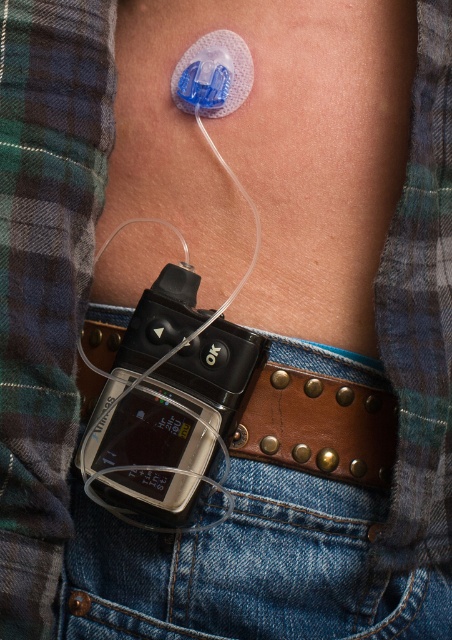
Question: Is denim at lower center smaller than brown leather belt at lower center?

Choices:
 (A) yes
 (B) no

Answer: (A)

Question: Is denim at lower center below brown leather belt at lower center?

Choices:
 (A) yes
 (B) no

Answer: (A)

Question: Which object is farther from the camera taking this photo?

Choices:
 (A) brown leather belt at lower center
 (B) denim at lower center

Answer: (B)

Question: Does denim at lower center have a smaller size compared to brown leather belt at lower center?

Choices:
 (A) yes
 (B) no

Answer: (A)

Question: Which of the following is the closest to the observer?

Choices:
 (A) brown leather belt at lower center
 (B) denim at lower center

Answer: (A)